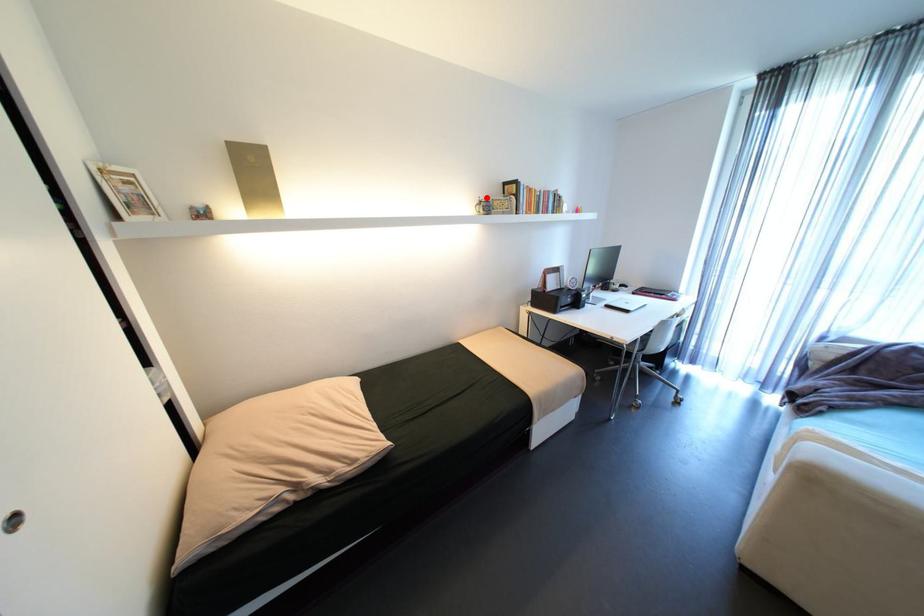
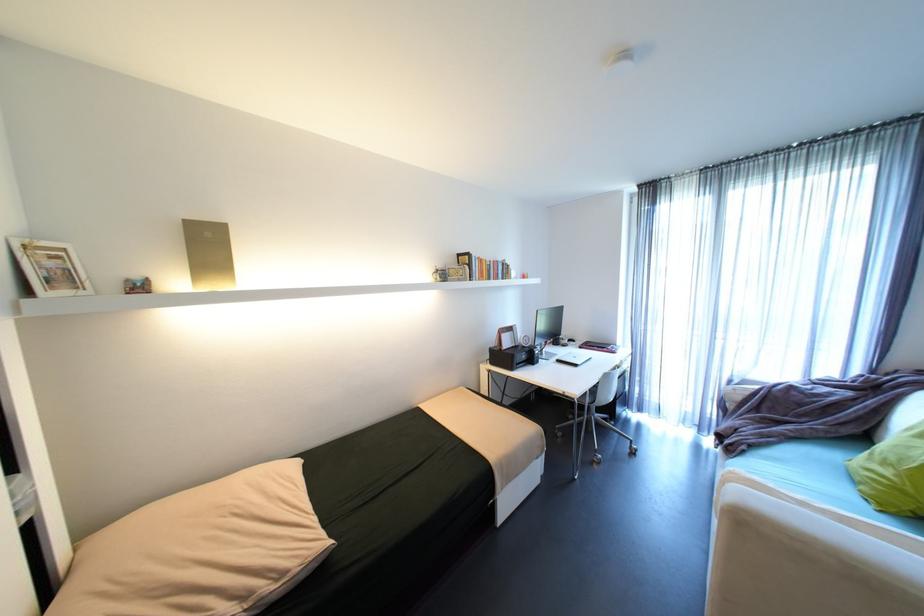
The point at the highlighted location is marked in the first image. Where is the corresponding point in the second image?

(444, 267)